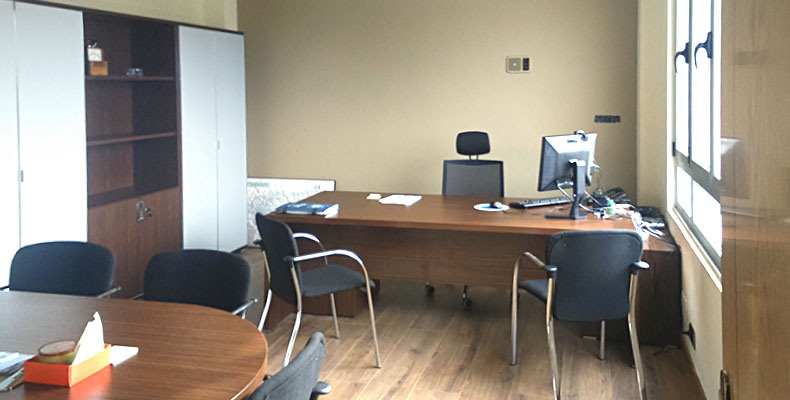
Where is `cabinet doors`? This screenshot has height=400, width=790. cabinet doors is located at coordinates (115, 238), (149, 228), (39, 172), (6, 128), (197, 134), (227, 112).